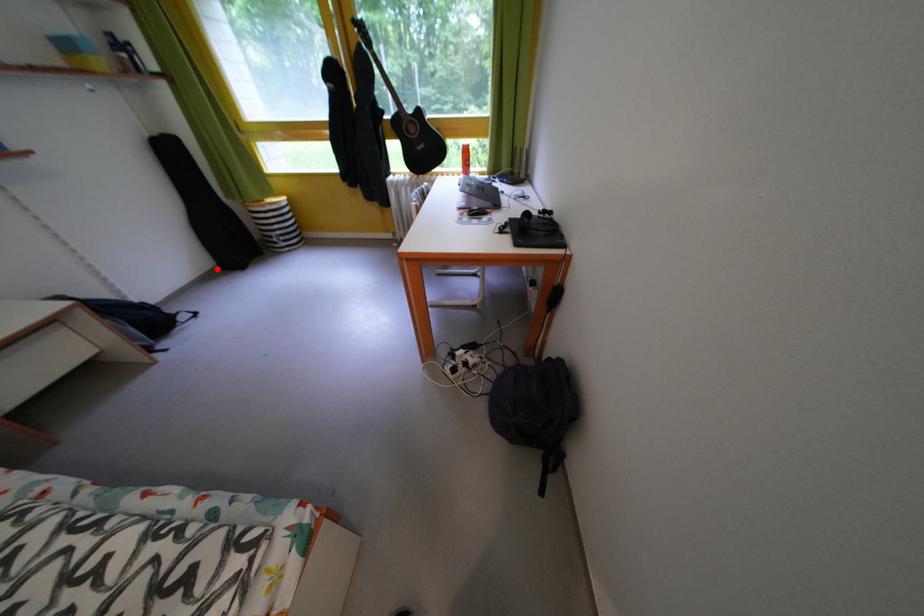
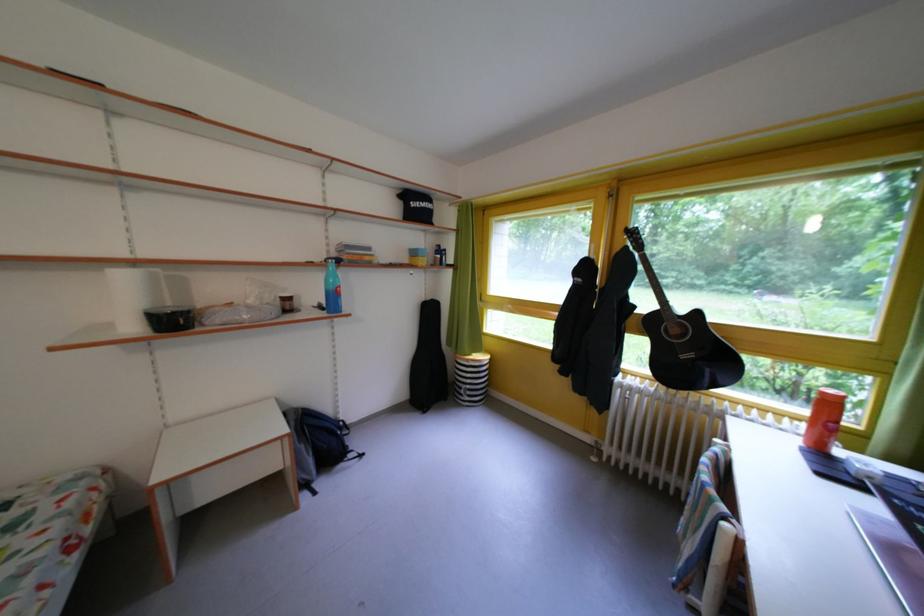
Question: I am providing you with two images of the same scene from different viewpoints. A red point is marked on the first image. At the location where the point appears in image 1, is it still visible in image 2?

Choices:
 (A) Yes
 (B) No

Answer: (A)